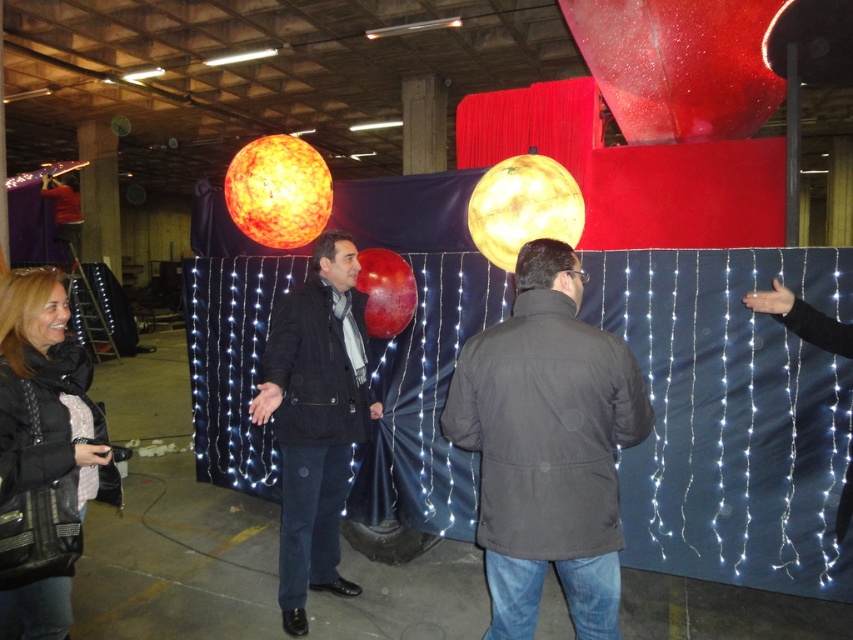
Question: From the image, what is the correct spatial relationship of dark gray jacket at center in relation to black quilted leather jacket at lower left?

Choices:
 (A) left
 (B) right

Answer: (B)

Question: Which point is closer to the camera?

Choices:
 (A) black quilted leather jacket at lower left
 (B) matte black jacket at center
 (C) dark gray jacket at center

Answer: (A)

Question: Is dark gray jacket at center closer to camera compared to black quilted leather jacket at lower left?

Choices:
 (A) no
 (B) yes

Answer: (A)

Question: Is black quilted leather jacket at lower left further to camera compared to matte black jacket at center?

Choices:
 (A) no
 (B) yes

Answer: (A)

Question: Based on their relative distances, which object is farther from the black quilted leather jacket at lower left?

Choices:
 (A) dark gray jacket at center
 (B) matte black jacket at center

Answer: (A)

Question: Which point is farther from the camera taking this photo?

Choices:
 (A) (276, 438)
 (B) (490, 509)

Answer: (A)